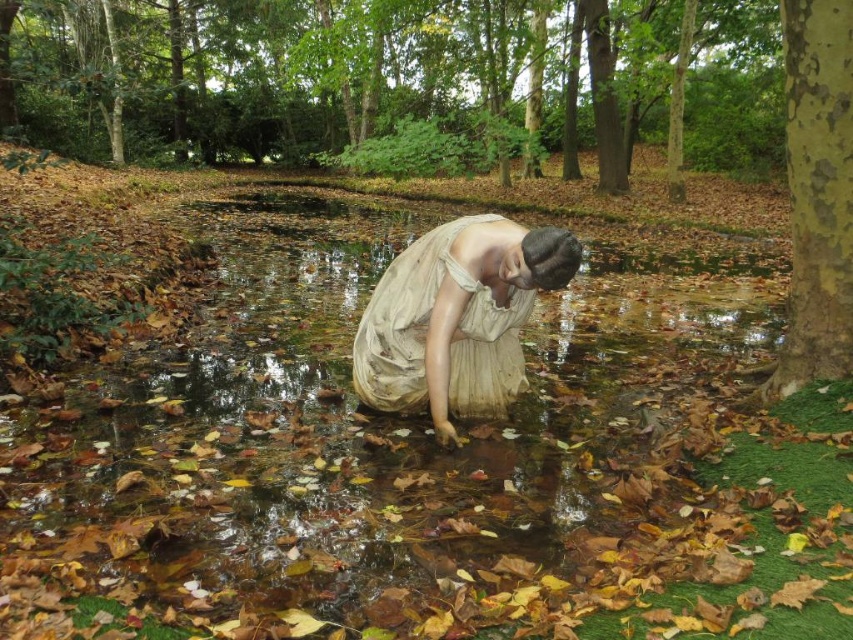
Question: Which point is farther from the camera taking this photo?

Choices:
 (A) (820, 88)
 (B) (444, 428)

Answer: (B)

Question: Is clear water at center smaller than matte white dress at center?

Choices:
 (A) no
 (B) yes

Answer: (A)

Question: Considering the real-world distances, which object is farthest from the clear water at center?

Choices:
 (A) matte white dress at center
 (B) smooth bark tree trunk at right

Answer: (B)

Question: Which of these objects is positioned farthest from the smooth bark tree trunk at right?

Choices:
 (A) clear water at center
 (B) matte white dress at center

Answer: (A)

Question: Can you confirm if clear water at center is thinner than matte white dress at center?

Choices:
 (A) yes
 (B) no

Answer: (B)

Question: Does clear water at center have a smaller size compared to smooth bark tree trunk at right?

Choices:
 (A) yes
 (B) no

Answer: (B)